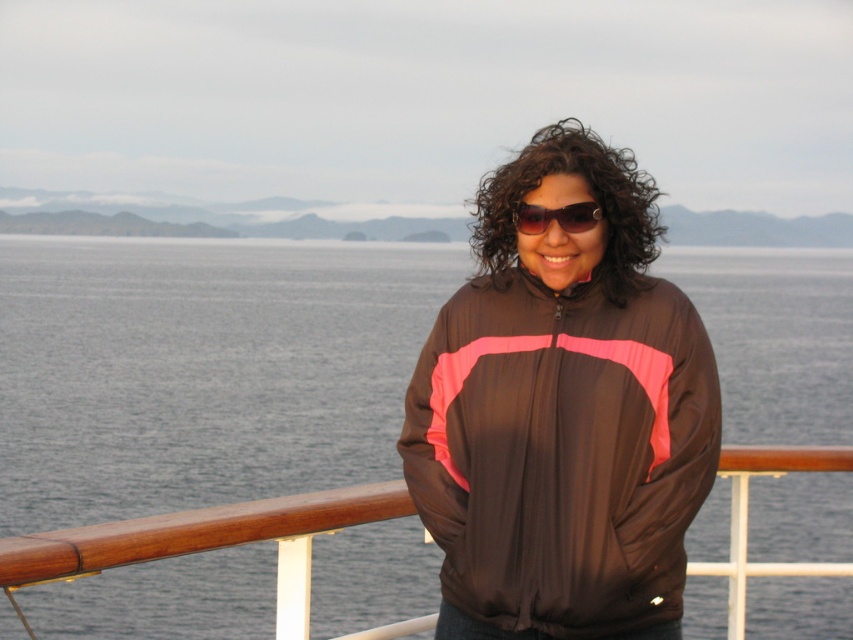
Does matte black jacket at center lie behind sunglasses at center?

That is False.

Is matte black jacket at center closer to the viewer compared to sunglasses at center?

Yes, matte black jacket at center is closer to the viewer.

I want to click on matte black jacket at center, so click(x=561, y=451).

I want to click on matte black jacket at center, so click(561, 451).

Who is shorter, gray water at center or sunglasses at center?

sunglasses at center is shorter.

Between gray water at center and sunglasses at center, which one is positioned higher?

Positioned higher is gray water at center.

Is point (215, 323) closer to camera compared to point (593, 205)?

No, it is not.

Identify the location of gray water at center. The width and height of the screenshot is (853, 640). tap(201, 369).

In the scene shown: Is gray water at center positioned at the back of matte black jacket at center?

Yes, gray water at center is behind matte black jacket at center.

Is point (744, 316) positioned before point (521, 365)?

No.

Which is behind, point (775, 556) or point (503, 515)?

The point (775, 556) is behind.

Locate an element on the screen. The width and height of the screenshot is (853, 640). gray water at center is located at coordinates coord(201,369).